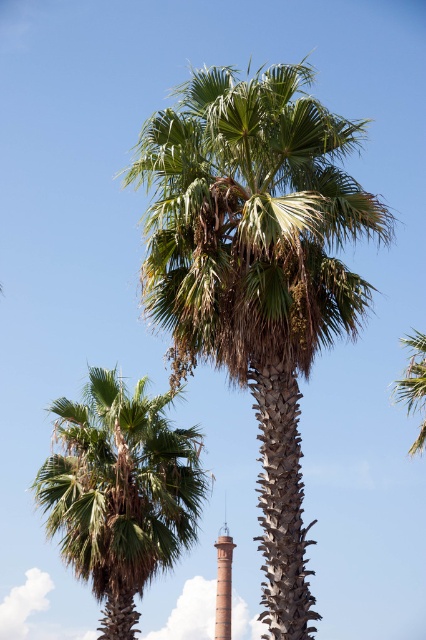
Question: Which object appears farthest from the camera in this image?

Choices:
 (A) smooth orange chimney at center
 (B) green leafy palm tree at upper right
 (C) green leafy palm tree at center

Answer: (A)

Question: Is green leafy palm tree at center further to camera compared to green leafy palm at lower left?

Choices:
 (A) no
 (B) yes

Answer: (A)

Question: Can you confirm if green leafy palm tree at upper right is bigger than smooth orange chimney at center?

Choices:
 (A) yes
 (B) no

Answer: (A)

Question: Which point appears farthest from the camera in this image?

Choices:
 (A) (399, 392)
 (B) (224, 586)
 (C) (161, 220)

Answer: (B)

Question: In this image, where is green leafy palm tree at center located relative to green leafy palm tree at upper right?

Choices:
 (A) left
 (B) right

Answer: (A)

Question: Considering the real-world distances, which object is closest to the smooth orange chimney at center?

Choices:
 (A) green leafy palm tree at upper right
 (B) green leafy palm at lower left

Answer: (A)